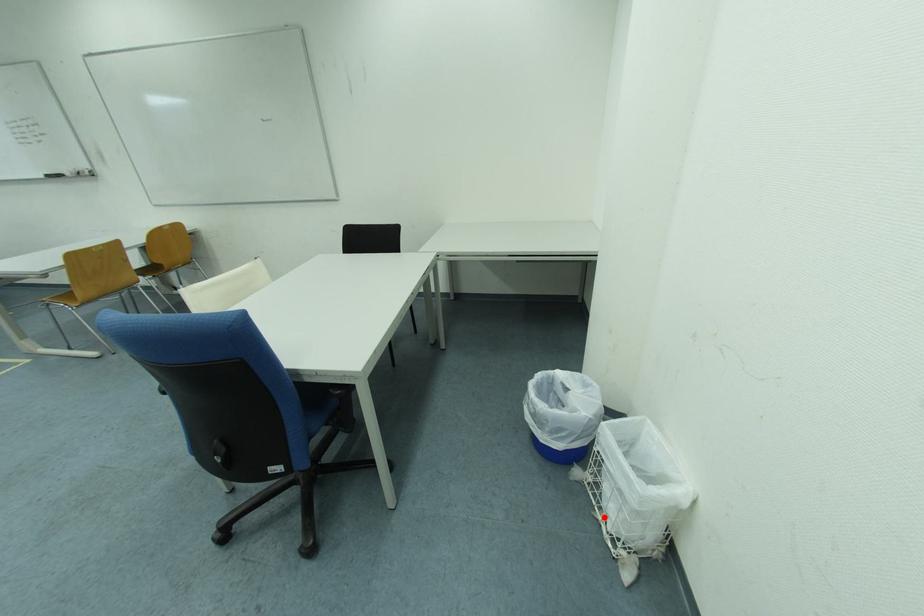
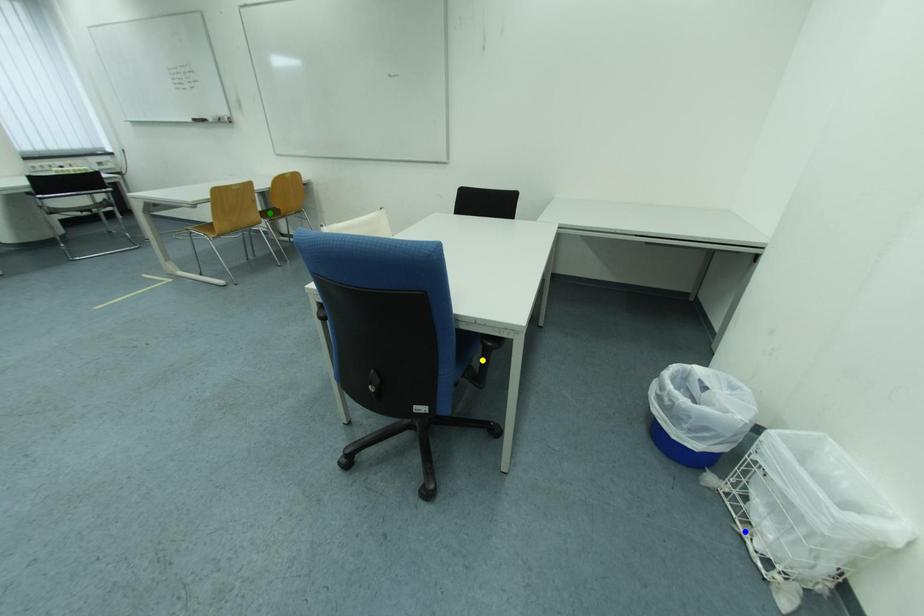
Question: I am providing you with two images of the same scene from different viewpoints. A red point is marked on the first image. You are given multiple points on the second image. Which point in image 2 represents the same 3d spot as the red point in image 1?

Choices:
 (A) blue point
 (B) green point
 (C) yellow point

Answer: (A)